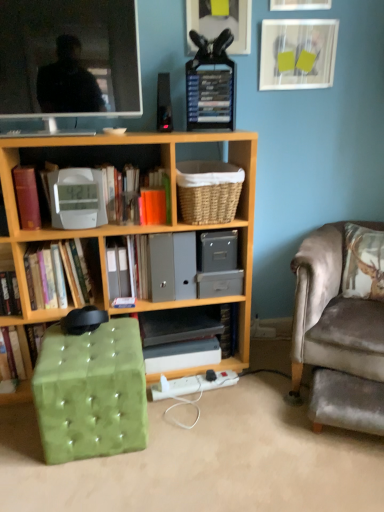
You are a GUI agent. You are given a task and a screenshot of the screen. Output one action in this format:
    pyautogui.click(x=<x>, y=<y>)
    Task: Click on the vacant area that is in front of velvet green footrest at lower right
    This screenshot has width=384, height=512.
    Given the screenshot: What is the action you would take?
    pyautogui.click(x=348, y=472)